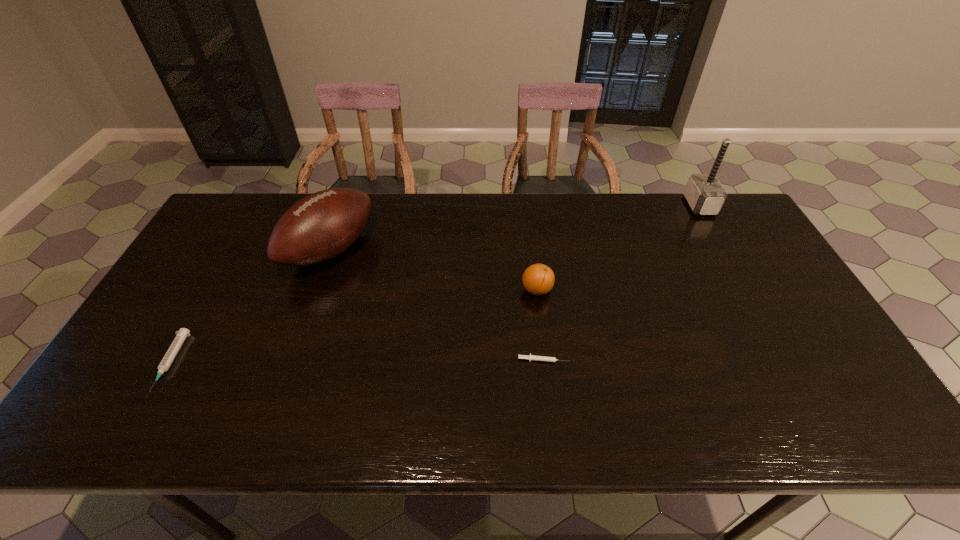
Where is `free region located 0.380m for striking with the head of the hammer`? The width and height of the screenshot is (960, 540). free region located 0.380m for striking with the head of the hammer is located at coordinates (577, 205).

I want to click on free space located for striking with the head of the hammer, so click(652, 205).

The image size is (960, 540). Find the location of `free space located on the front of the football (American)`. free space located on the front of the football (American) is located at coordinates (295, 352).

Find the location of a particular element. Image resolution: width=960 pixels, height=540 pixels. free space located 0.190m on the right of the orange is located at coordinates (620, 290).

The height and width of the screenshot is (540, 960). What are the coordinates of `vacant space located at the needle end of the taller syringe` in the screenshot? It's located at (132, 432).

Find the location of `free space located 0.310m on the right of the shorter syringe`. free space located 0.310m on the right of the shorter syringe is located at coordinates (694, 360).

Locate an element on the screen. This screenshot has width=960, height=540. hammer that is positioned at the far edge is located at coordinates (704, 193).

Identify the location of football (American) at the far edge. (322, 225).

You are a GUI agent. You are given a task and a screenshot of the screen. Output one action in this format:
    pyautogui.click(x=<x>, y=<y>)
    Task: Click on the object that is at the left edge
    This screenshot has width=960, height=540.
    Given the screenshot: What is the action you would take?
    pyautogui.click(x=171, y=353)

This screenshot has height=540, width=960. Find the location of `object that is at the right edge`. object that is at the right edge is located at coordinates (704, 193).